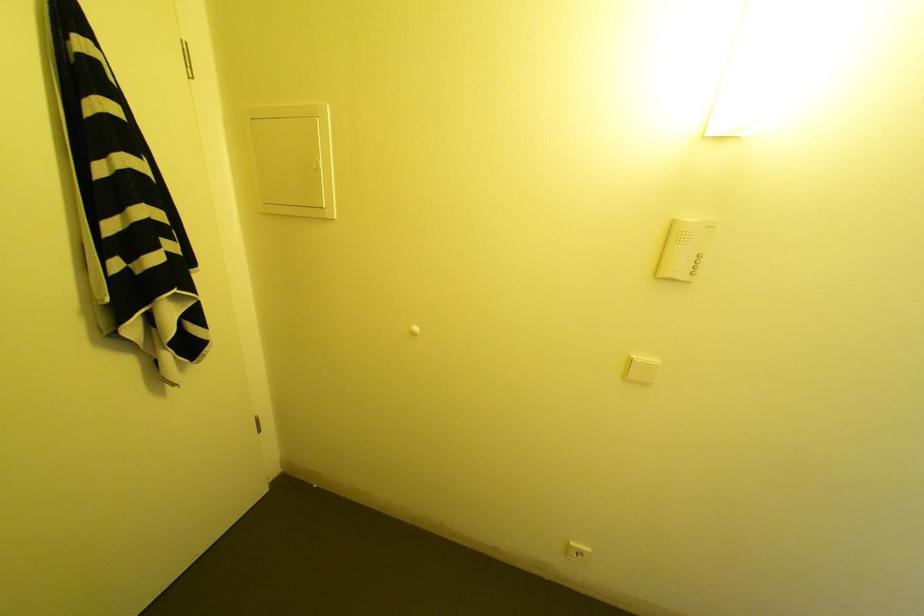
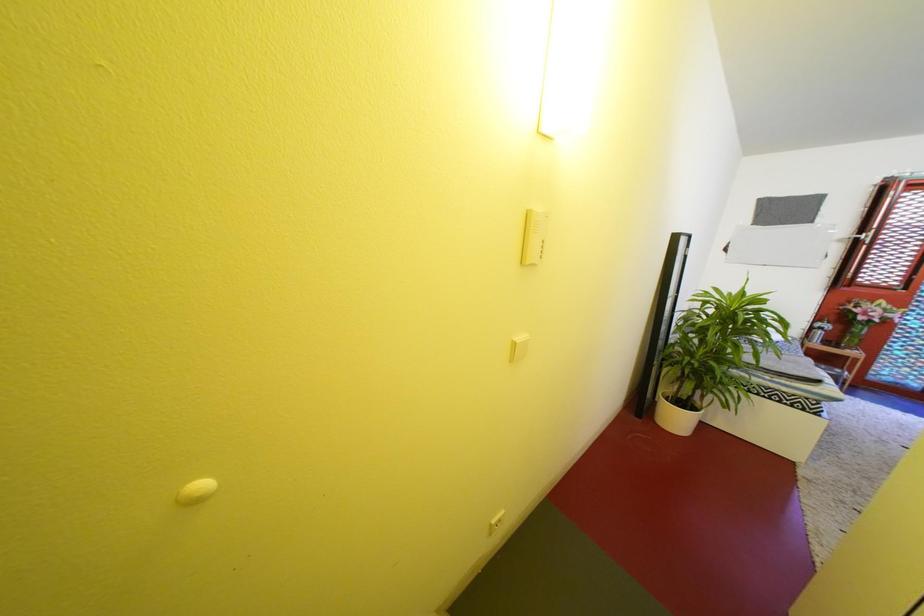
Question: The camera is either moving clockwise (left) or counter-clockwise (right) around the object. The first image is from the beginning of the video and the second image is from the end. Is the camera moving left or right when shooting the video?

Choices:
 (A) Left
 (B) Right

Answer: (A)